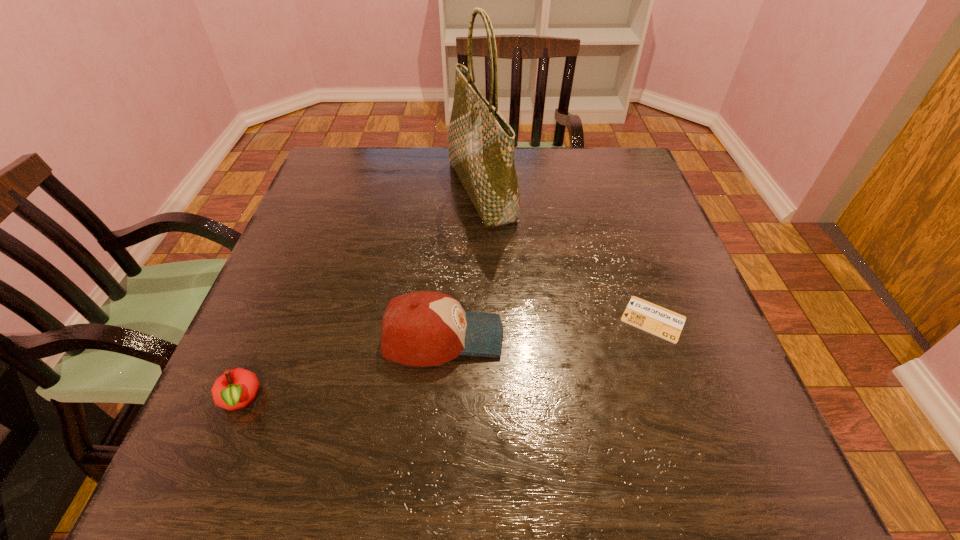
You are a GUI agent. You are given a task and a screenshot of the screen. Output one action in this format:
    pyautogui.click(x=<x>, y=<y>)
    Task: Click on the shopping bag
    
    Given the screenshot: What is the action you would take?
    pyautogui.click(x=481, y=143)

The height and width of the screenshot is (540, 960). Find the location of `the farthest object`. the farthest object is located at coordinates point(481,143).

Locate an element on the screen. The height and width of the screenshot is (540, 960). the third shortest object is located at coordinates (424, 328).

The image size is (960, 540). I want to click on apple, so click(x=235, y=389).

The height and width of the screenshot is (540, 960). I want to click on the third tallest object, so click(235, 389).

What are the coordinates of `the rightmost object` in the screenshot? It's located at (666, 324).

This screenshot has height=540, width=960. Identify the location of the shortest object. (666, 324).

The width and height of the screenshot is (960, 540). I want to click on free location located on the right of the shopping bag, so click(x=573, y=191).

Identify the location of vacant space located on the front-facing side of the third shortest object. The height and width of the screenshot is (540, 960). (562, 337).

Locate an element on the screen. Image resolution: width=960 pixels, height=540 pixels. free spot located on the right of the third tallest object is located at coordinates (422, 400).